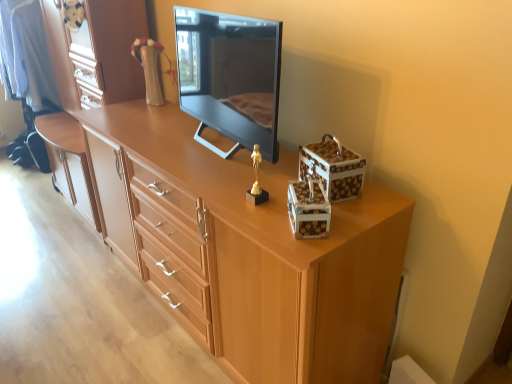
Locate an element on the screen. This screenshot has width=512, height=384. unoccupied area in front of black glossy television at center is located at coordinates (240, 183).